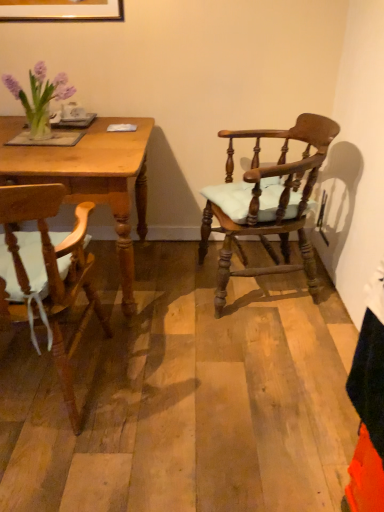
The height and width of the screenshot is (512, 384). Find the location of `spots to the right of white ceramic mug at upper left`. spots to the right of white ceramic mug at upper left is located at coordinates (116, 120).